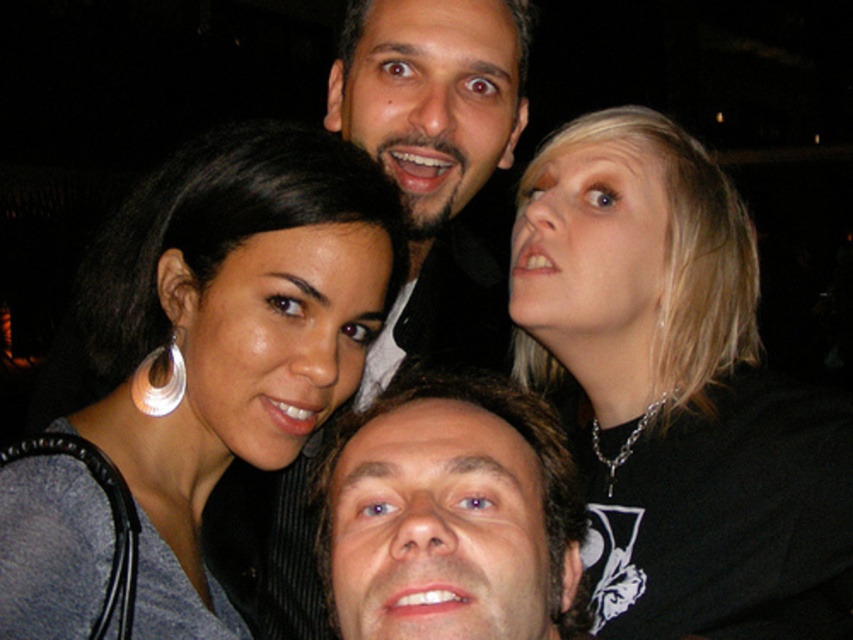
You are standing in front of a group photo where two points are marked as point 1 at coordinates point (670, 276) and point 2 at coordinates point (119, 426). Which point is closer to you?

Point (670, 276) is further to the viewer than point (119, 426), so point (670, 276) is closer to you.